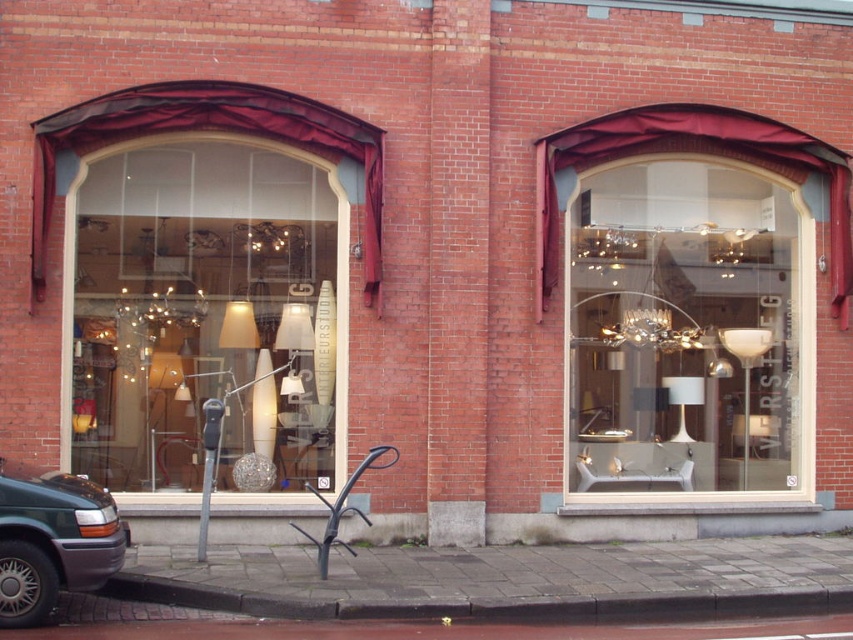
Question: Among these points, which one is nearest to the camera?

Choices:
 (A) (608, 147)
 (B) (372, 602)
 (C) (85, 106)
 (D) (142, 396)

Answer: (B)

Question: Which point is farther to the camera?

Choices:
 (A) (32, 561)
 (B) (276, 340)
 (C) (699, 196)
 (D) (177, 84)

Answer: (C)

Question: Estimate the real-world distances between objects in this image. Which object is closer to the velvet burgundy curtain at upper left?

Choices:
 (A) metallic gray van at lower left
 (B) matte glass lamp at center

Answer: (B)

Question: Does matte glass lamp at center appear on the right side of white glossy lamp at center?

Choices:
 (A) yes
 (B) no

Answer: (B)

Question: Where is matte glass lamp at center located in relation to metallic gray van at lower left in the image?

Choices:
 (A) below
 (B) above

Answer: (B)

Question: Is matte glass lamp at center above white glossy lamp at center?

Choices:
 (A) no
 (B) yes

Answer: (B)